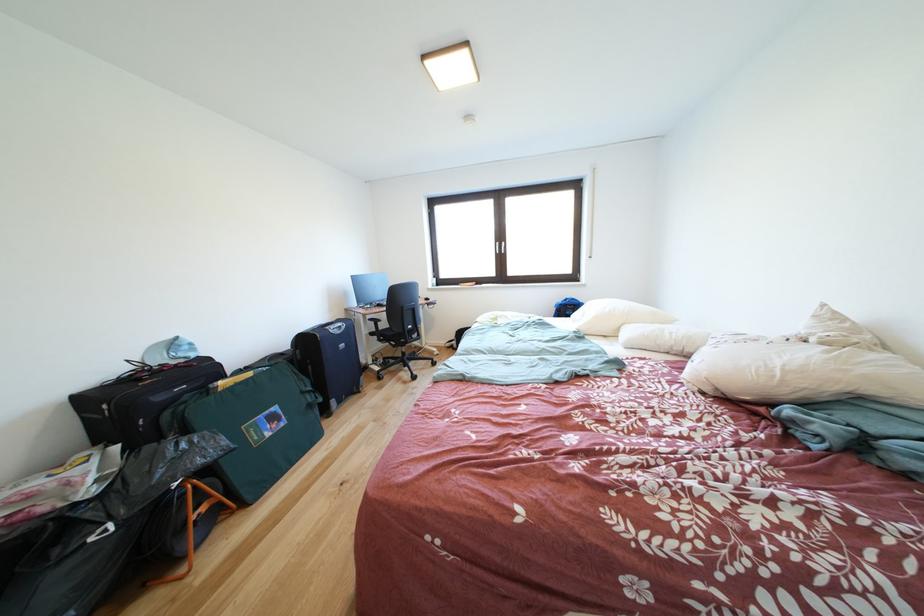
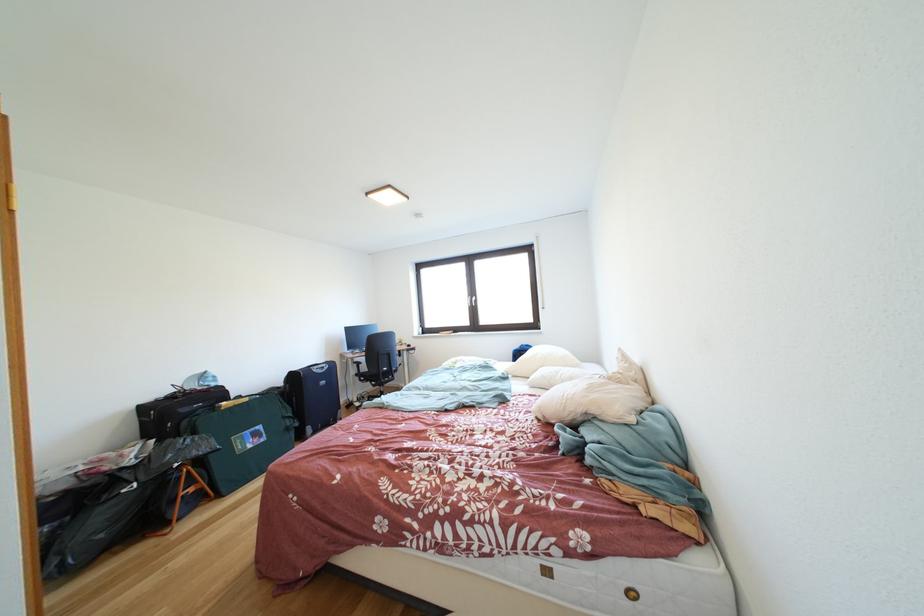
Question: I am providing you with two images of the same scene from different viewpoints. Which of the following objects are not visible in image2?

Choices:
 (A) white pillow
 (B) black suitcase handle
 (C) green bag handle
 (D) none of these

Answer: (D)